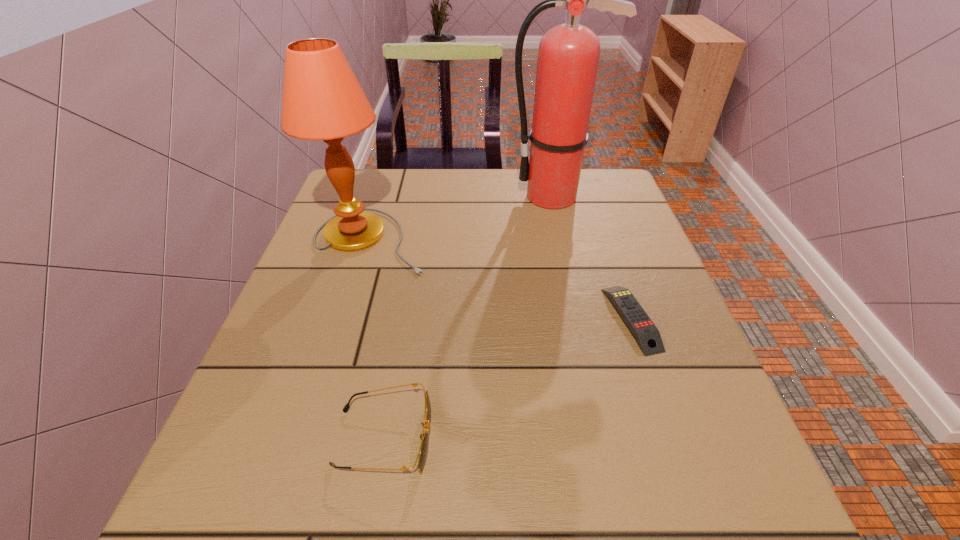
Where is `vacant point located 0.240m on the front-facing side of the second shortest object`? The width and height of the screenshot is (960, 540). vacant point located 0.240m on the front-facing side of the second shortest object is located at coordinates [x=589, y=438].

Find the location of `blank space located 0.170m on the front of the third farthest object`. blank space located 0.170m on the front of the third farthest object is located at coordinates (676, 448).

You are a GUI agent. You are given a task and a screenshot of the screen. Output one action in this format:
    pyautogui.click(x=<x>, y=<y>)
    Task: Click on the fire extinguisher that is positioned at the far edge
    The width and height of the screenshot is (960, 540).
    Given the screenshot: What is the action you would take?
    pyautogui.click(x=568, y=55)

Where is `lamp present at the far edge`? The height and width of the screenshot is (540, 960). lamp present at the far edge is located at coordinates (322, 100).

Find the location of a particular element. This screenshot has width=960, height=540. object that is at the near edge is located at coordinates (422, 453).

Where is `object that is positioned at the left edge`? The width and height of the screenshot is (960, 540). object that is positioned at the left edge is located at coordinates (322, 100).

The width and height of the screenshot is (960, 540). I want to click on fire extinguisher present at the right edge, so click(x=568, y=55).

Locate an element on the screen. remote control that is at the right edge is located at coordinates (647, 335).

At what (x,y) coordinates should I click in order to perform the action: click on object at the far left corner. Please return your answer as a coordinate pair (x, y). The height and width of the screenshot is (540, 960). Looking at the image, I should click on (322, 100).

Locate an element on the screen. object that is at the far right corner is located at coordinates (568, 55).